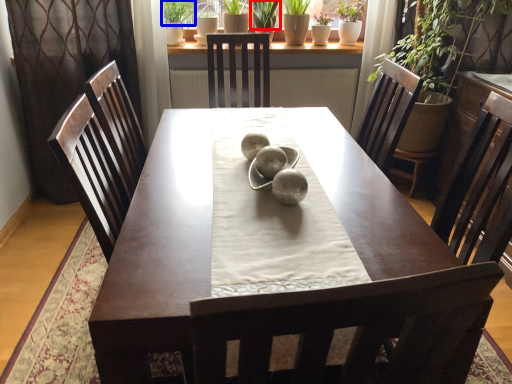
Question: Which object appears closest to the camera in this image, plant (highlighted by a red box) or plant (highlighted by a blue box)?

Choices:
 (A) plant
 (B) plant

Answer: (B)